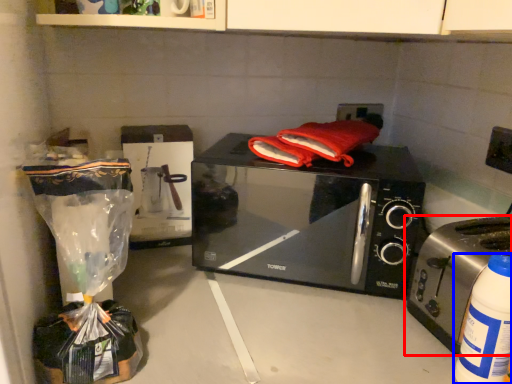
Question: Which object appears closest to the camera in this image, toaster (highlighted by a red box) or bottle (highlighted by a blue box)?

Choices:
 (A) toaster
 (B) bottle

Answer: (B)